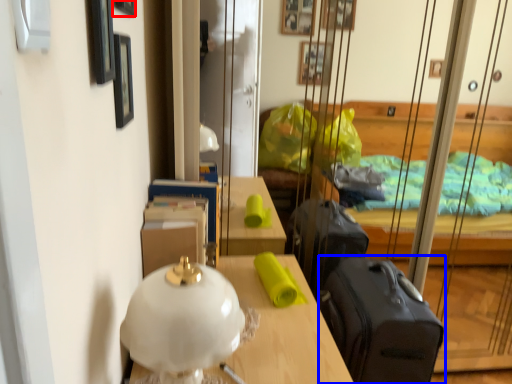
Question: Which of the following is the closest to the observer, picture frame (highlighted by a red box) or suitcase (highlighted by a blue box)?

Choices:
 (A) picture frame
 (B) suitcase

Answer: (A)